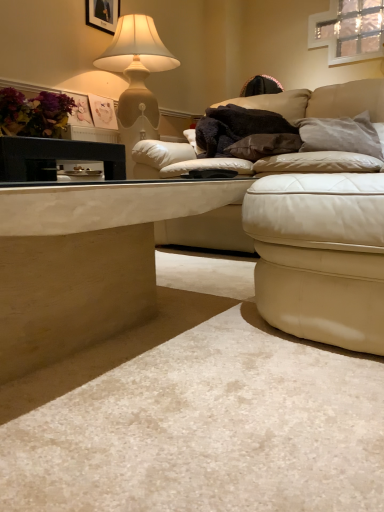
I want to click on free spot in front of leather ottoman at lower right, so click(x=276, y=402).